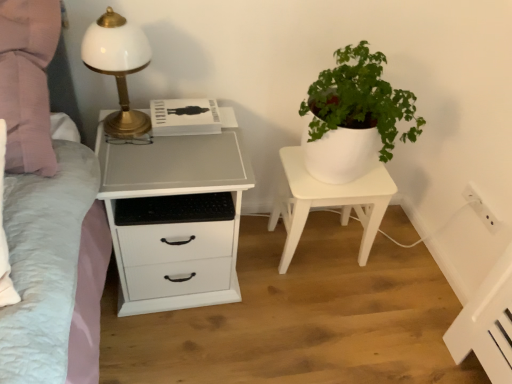
Find the location of a particular element. The width and height of the screenshot is (512, 384). white matte chest of drawers at left is located at coordinates (175, 219).

The height and width of the screenshot is (384, 512). Describe the element at coordinates (328, 201) in the screenshot. I see `white matte plant pot at center` at that location.

Image resolution: width=512 pixels, height=384 pixels. What are the coordinates of `white plastic electric outlet at upper right` in the screenshot? It's located at (481, 207).

Where is `white matte chest of drawers at left`? white matte chest of drawers at left is located at coordinates (175, 219).

Is point (381, 201) closer to viewer compared to point (223, 281)?

Yes, it is in front of point (223, 281).

Which of these two, white matte plant pot at center or white matte chest of drawers at left, stands shorter?

Standing shorter between the two is white matte plant pot at center.

Which of these two, white matte plant pot at center or white matte chest of drawers at left, is bigger?

With larger size is white matte chest of drawers at left.

From the picture: Could you tell me if white matte plant pot at center is facing white glossy table lamp at left?

No, white matte plant pot at center is not facing towards white glossy table lamp at left.

From the image's perspective, relative to white glossy table lamp at left, is white matte plant pot at center above or below?

From the image's perspective, white matte plant pot at center appears below white glossy table lamp at left.

Considering the positions of objects white matte plant pot at center and white glossy table lamp at left in the image provided, who is in front, white matte plant pot at center or white glossy table lamp at left?

white glossy table lamp at left is closer to the camera.

Is point (367, 202) more distant than point (120, 140)?

Yes.

Which is correct: white plastic electric outlet at upper right is inside white matte chest of drawers at left, or outside of it?

white plastic electric outlet at upper right is not enclosed by white matte chest of drawers at left.

Visually, is white plastic electric outlet at upper right positioned to the left or to the right of white matte chest of drawers at left?

Clearly, white plastic electric outlet at upper right is on the right of white matte chest of drawers at left in the image.

Which of these two, white plastic electric outlet at upper right or white matte chest of drawers at left, is smaller?

Smaller between the two is white plastic electric outlet at upper right.

Considering the sizes of objects white plastic electric outlet at upper right and white matte chest of drawers at left in the image provided, who is thinner, white plastic electric outlet at upper right or white matte chest of drawers at left?

With smaller width is white plastic electric outlet at upper right.

Is white glossy table lamp at left not inside white matte chest of drawers at left?

Yes, white glossy table lamp at left is not within white matte chest of drawers at left.

From a real-world perspective, is white glossy table lamp at left physically below white matte chest of drawers at left?

No, from a real-world perspective, white glossy table lamp at left is not under white matte chest of drawers at left.

In the image, is white glossy table lamp at left positioned in front of or behind white matte chest of drawers at left?

white glossy table lamp at left is positioned closer to the viewer than white matte chest of drawers at left.

From a real-world perspective, who is located higher, white glossy table lamp at left or white matte plant pot at center?

white glossy table lamp at left is physically above.

Considering the sizes of white glossy table lamp at left and white matte plant pot at center in the image, is white glossy table lamp at left bigger or smaller than white matte plant pot at center?

Considering their sizes, white glossy table lamp at left takes up less space than white matte plant pot at center.

Find the location of a particular element. The width and height of the screenshot is (512, 384). table lamp above the white matte plant pot at center (from the image's perspective) is located at coordinates (119, 72).

Considering the sizes of white plastic electric outlet at upper right and white matte plant pot at center in the image, is white plastic electric outlet at upper right bigger or smaller than white matte plant pot at center?

Considering their sizes, white plastic electric outlet at upper right takes up less space than white matte plant pot at center.

Which is closer to the camera, [483,208] or [349,203]?

Positioned in front is point [349,203].

In the scene shown: Is white plastic electric outlet at upper right positioned beyond the bounds of white matte plant pot at center?

That's correct, white plastic electric outlet at upper right is outside of white matte plant pot at center.

From the picture: Is white plastic electric outlet at upper right turned away from white matte plant pot at center?

That's not correct — white plastic electric outlet at upper right is not looking away from white matte plant pot at center.

Considering the relative sizes of white matte chest of drawers at left and white plastic electric outlet at upper right in the image provided, is white matte chest of drawers at left smaller than white plastic electric outlet at upper right?

Incorrect, white matte chest of drawers at left is not smaller in size than white plastic electric outlet at upper right.

Considering the sizes of white matte chest of drawers at left and white plastic electric outlet at upper right in the image, is white matte chest of drawers at left wider or thinner than white plastic electric outlet at upper right?

In the image, white matte chest of drawers at left appears to be wider than white plastic electric outlet at upper right.

Is white matte chest of drawers at left spatially inside white plastic electric outlet at upper right, or outside of it?

white matte chest of drawers at left exists outside the volume of white plastic electric outlet at upper right.

Does white matte chest of drawers at left come behind white plastic electric outlet at upper right?

No, the depth of white matte chest of drawers at left is less than that of white plastic electric outlet at upper right.

Locate an element on the screen. nightstand on the right of white matte chest of drawers at left is located at coordinates (328, 201).

At what (x,y) coordinates should I click in order to perform the action: click on nightstand located below the white glossy table lamp at left (from the image's perspective). Please return your answer as a coordinate pair (x, y). Looking at the image, I should click on (328, 201).

Looking at the image, which one is located further to white matte plant pot at center, white glossy table lamp at left or white plastic electric outlet at upper right?

white glossy table lamp at left is further to white matte plant pot at center.

When comparing their distances from white plastic electric outlet at upper right, does white glossy table lamp at left or white matte chest of drawers at left seem closer?

The object closer to white plastic electric outlet at upper right is white matte chest of drawers at left.

Based on their spatial positions, is white plastic electric outlet at upper right or white glossy table lamp at left further from white matte chest of drawers at left?

white plastic electric outlet at upper right lies further to white matte chest of drawers at left than the other object.

Which object lies further to the anchor point white plastic electric outlet at upper right, white matte chest of drawers at left or white matte plant pot at center?

A: white matte chest of drawers at left is further to white plastic electric outlet at upper right.

Looking at the image, which one is located further to white matte chest of drawers at left, white plastic electric outlet at upper right or white matte plant pot at center?

white plastic electric outlet at upper right is further to white matte chest of drawers at left.

Considering their positions, is white matte chest of drawers at left positioned closer to white plastic electric outlet at upper right than white glossy table lamp at left?

Based on the image, white matte chest of drawers at left appears to be nearer to white plastic electric outlet at upper right.

Which object lies nearer to the anchor point white matte chest of drawers at left, white glossy table lamp at left or white plastic electric outlet at upper right?

Based on the image, white glossy table lamp at left appears to be nearer to white matte chest of drawers at left.

Which object lies further to the anchor point white glossy table lamp at left, white matte chest of drawers at left or white matte plant pot at center?

The object further to white glossy table lamp at left is white matte plant pot at center.

This screenshot has width=512, height=384. In order to click on the chest of drawers located between white glossy table lamp at left and white plastic electric outlet at upper right in the left-right direction in this screenshot , I will do `click(175, 219)`.

Find the location of a particular element. chest of drawers between white glossy table lamp at left and white matte plant pot at center in the horizontal direction is located at coordinates (175, 219).

Find the location of a particular element. The height and width of the screenshot is (384, 512). nightstand between white matte chest of drawers at left and white plastic electric outlet at upper right from left to right is located at coordinates (328, 201).

Identify the location of nightstand between white glossy table lamp at left and white plastic electric outlet at upper right in the horizontal direction. This screenshot has height=384, width=512. (328, 201).